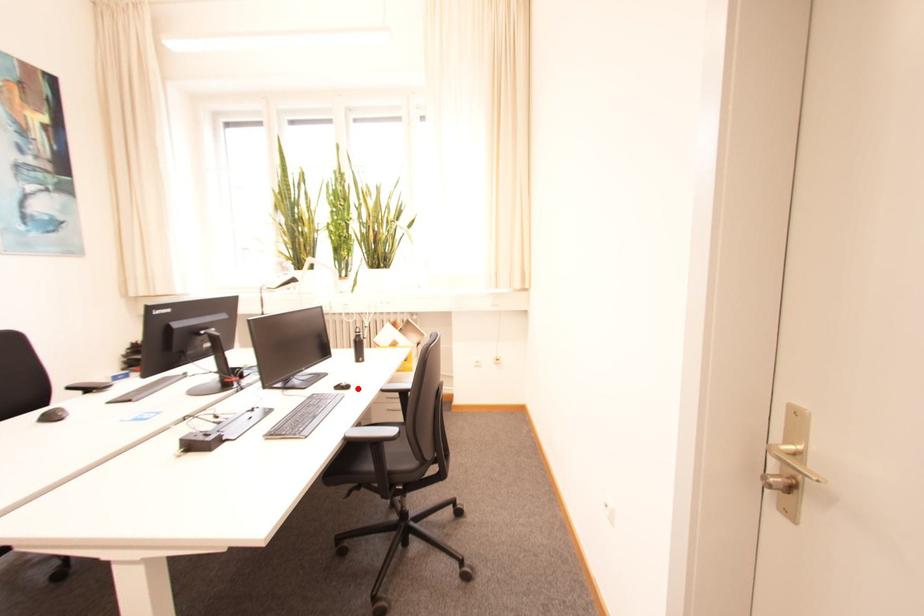
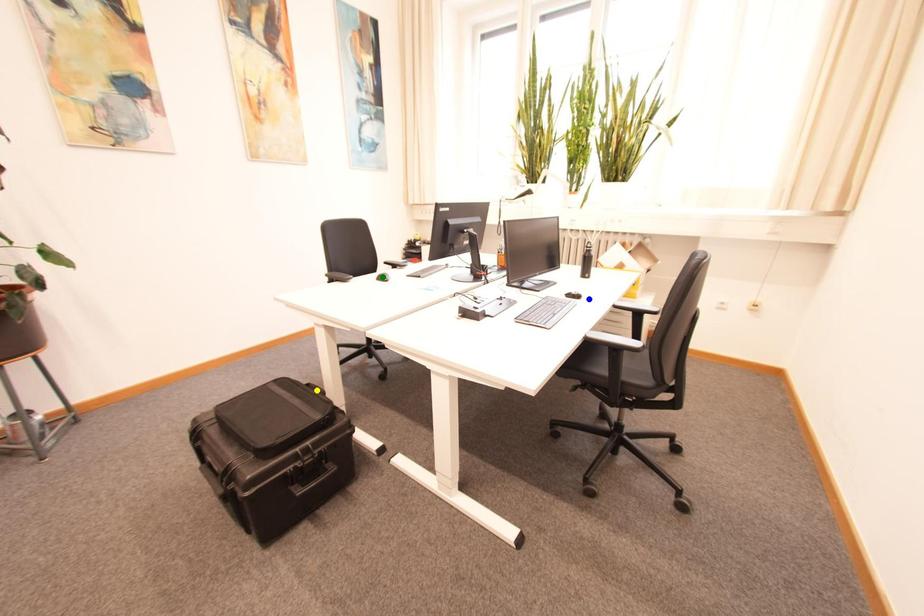
Question: I am providing you with two images of the same scene from different viewpoints. A red point is marked on the first image. You are given multiple points on the second image. Which spot in image 2 lines up with the point in image 1?

Choices:
 (A) green point
 (B) yellow point
 (C) blue point

Answer: (C)